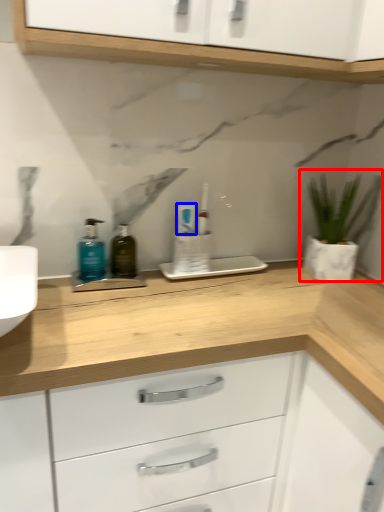
Question: Which point is further to the camera, houseplant (highlighted by a red box) or toothpaste (highlighted by a blue box)?

Choices:
 (A) houseplant
 (B) toothpaste

Answer: (B)